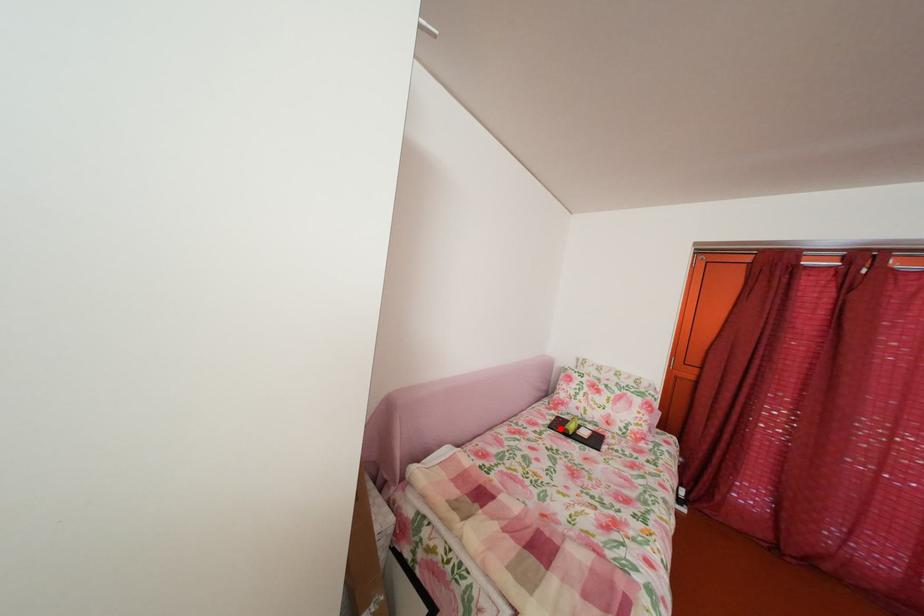
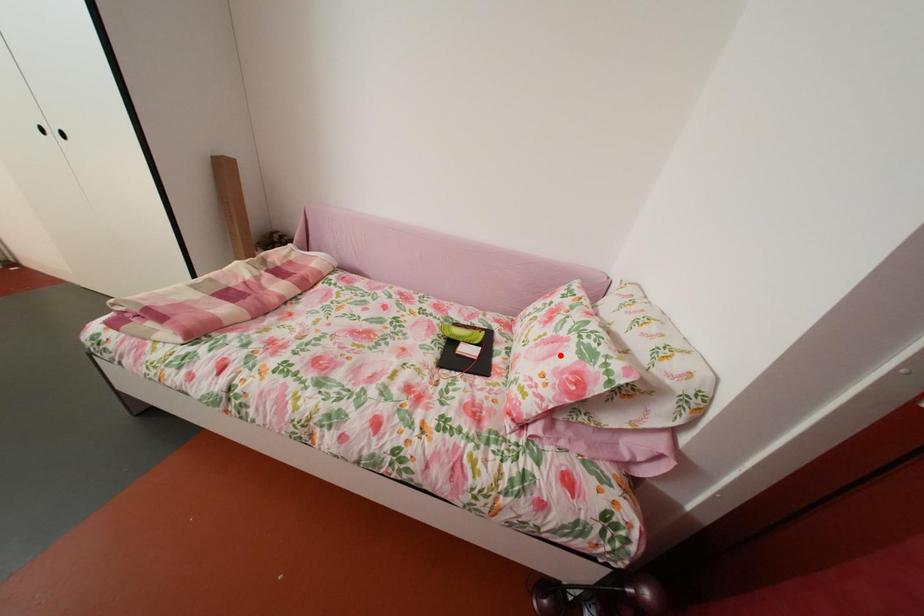
I am providing you with two images of the same scene from different viewpoints. A red point is marked on the first image and another point is marked on the second image. Are the points marked in image1 and image2 representing the same 3D position?

No